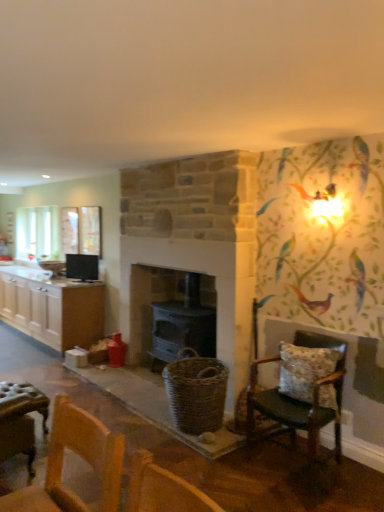
Question: Does floral fabric cushioned chair at right have a greater width compared to fluffy fabric pillow at right?

Choices:
 (A) no
 (B) yes

Answer: (B)

Question: From a real-world perspective, is floral fabric cushioned chair at right physically above fluffy fabric pillow at right?

Choices:
 (A) yes
 (B) no

Answer: (B)

Question: Is floral fabric cushioned chair at right not close to fluffy fabric pillow at right?

Choices:
 (A) yes
 (B) no

Answer: (B)

Question: Can we say floral fabric cushioned chair at right lies outside fluffy fabric pillow at right?

Choices:
 (A) yes
 (B) no

Answer: (A)

Question: Is floral fabric cushioned chair at right further to camera compared to fluffy fabric pillow at right?

Choices:
 (A) no
 (B) yes

Answer: (A)

Question: Could you tell me if floral fabric cushioned chair at right is facing fluffy fabric pillow at right?

Choices:
 (A) yes
 (B) no

Answer: (A)

Question: Would you say black glossy monitor at upper left is a long distance from fluffy fabric pillow at right?

Choices:
 (A) yes
 (B) no

Answer: (A)

Question: Considering the relative sizes of black glossy monitor at upper left and fluffy fabric pillow at right in the image provided, is black glossy monitor at upper left wider than fluffy fabric pillow at right?

Choices:
 (A) yes
 (B) no

Answer: (B)

Question: Is fluffy fabric pillow at right at the back of black glossy monitor at upper left?

Choices:
 (A) no
 (B) yes

Answer: (A)

Question: From a real-world perspective, is black glossy monitor at upper left under fluffy fabric pillow at right?

Choices:
 (A) yes
 (B) no

Answer: (B)

Question: From the image's perspective, does black glossy monitor at upper left appear higher than fluffy fabric pillow at right?

Choices:
 (A) no
 (B) yes

Answer: (B)

Question: Is black glossy monitor at upper left thinner than fluffy fabric pillow at right?

Choices:
 (A) no
 (B) yes

Answer: (B)

Question: Can we say black glossy monitor at upper left lies outside floral fabric cushioned chair at right?

Choices:
 (A) no
 (B) yes

Answer: (B)